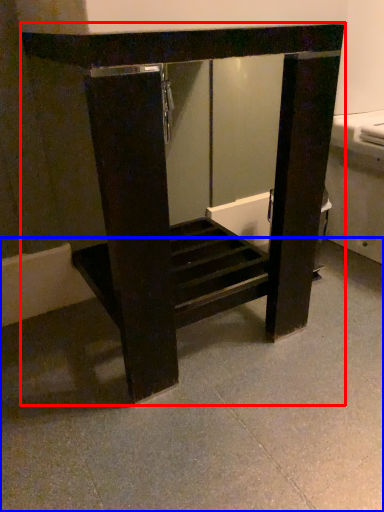
Question: Which point is further to the camera, furniture (highlighted by a red box) or concrete (highlighted by a blue box)?

Choices:
 (A) furniture
 (B) concrete

Answer: (A)